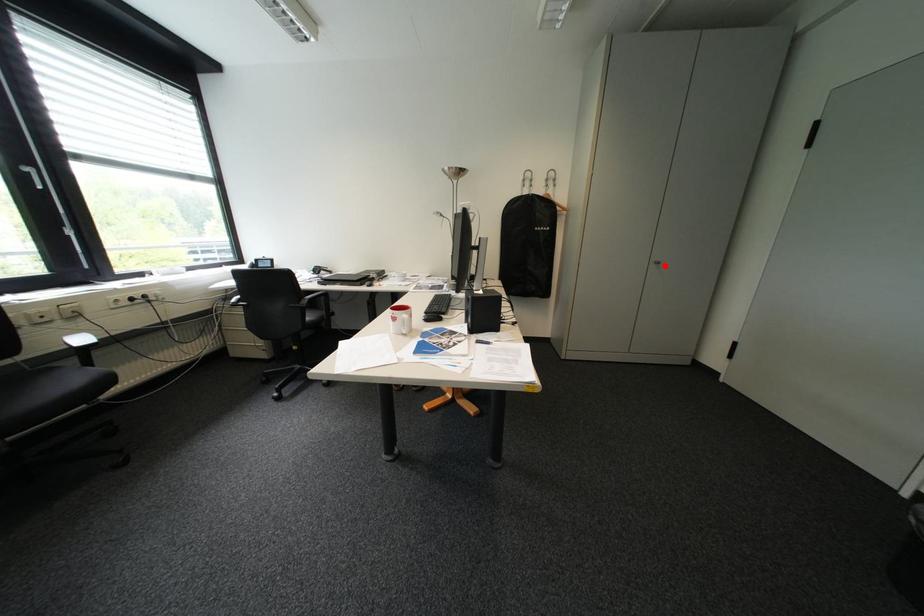
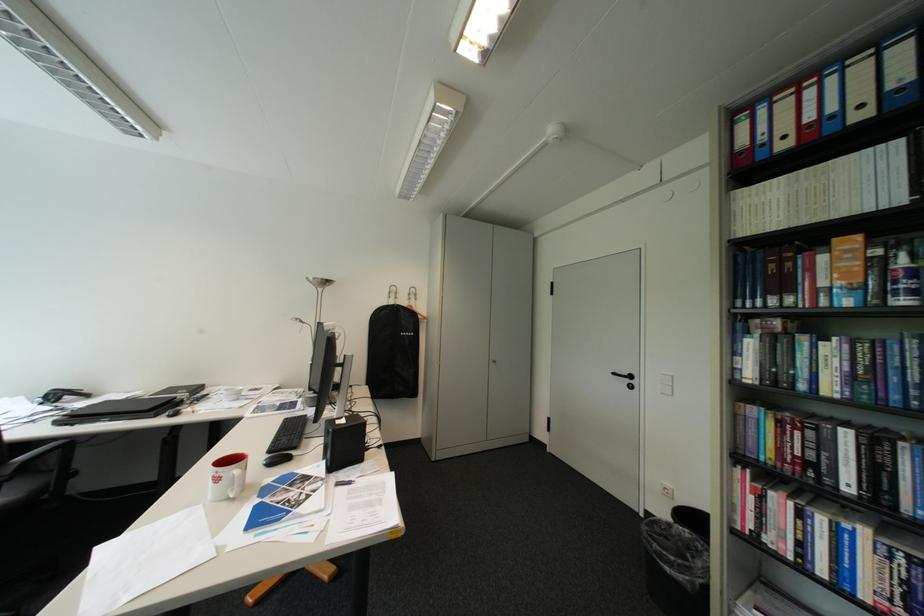
Find the pixel in the second image that matches the highlighted location in the first image.

(504, 363)